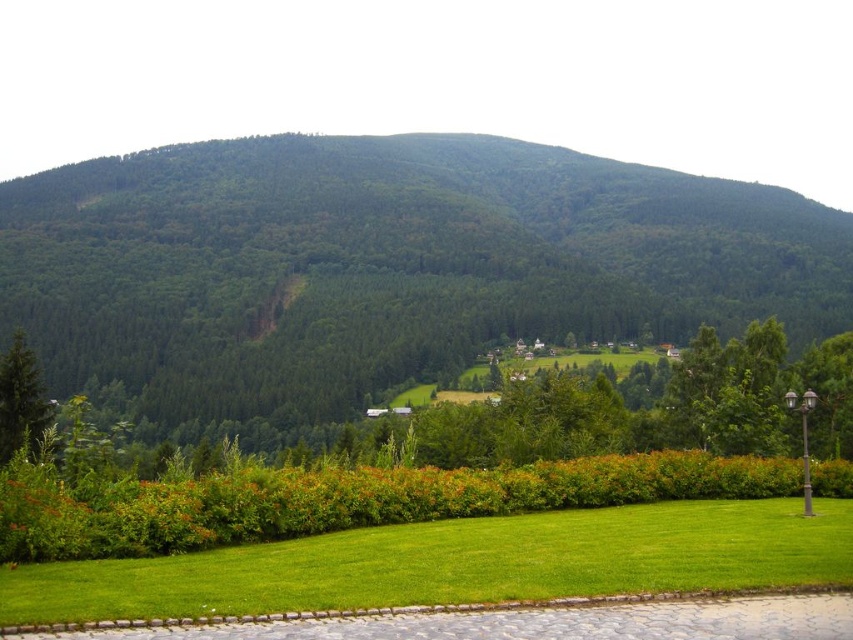
Identify the location of green lawn at center. (457, 563).

Which is more to the left, green lawn at center or green matte tree at lower left?

Positioned to the left is green matte tree at lower left.

Identify the location of green lawn at center. The width and height of the screenshot is (853, 640). (457, 563).

Looking at this image, who is more forward, (131, 186) or (21, 387)?

Point (21, 387) is more forward.

Is the position of green forested mountain at upper center more distant than that of green matte tree at lower left?

Yes.

Who is more forward, (178,234) or (21,428)?

Point (21,428) is in front.

Locate an element on the screen. green forested mountain at upper center is located at coordinates (383, 266).

Between green forested mountain at upper center and green lawn at center, which one appears on the right side from the viewer's perspective?

green forested mountain at upper center is more to the right.

Is green forested mountain at upper center closer to the viewer compared to green lawn at center?

That is False.

Is point (503, 205) farther from camera compared to point (729, 564)?

Yes, point (503, 205) is behind point (729, 564).

What are the coordinates of `green forested mountain at upper center` in the screenshot? It's located at (383, 266).